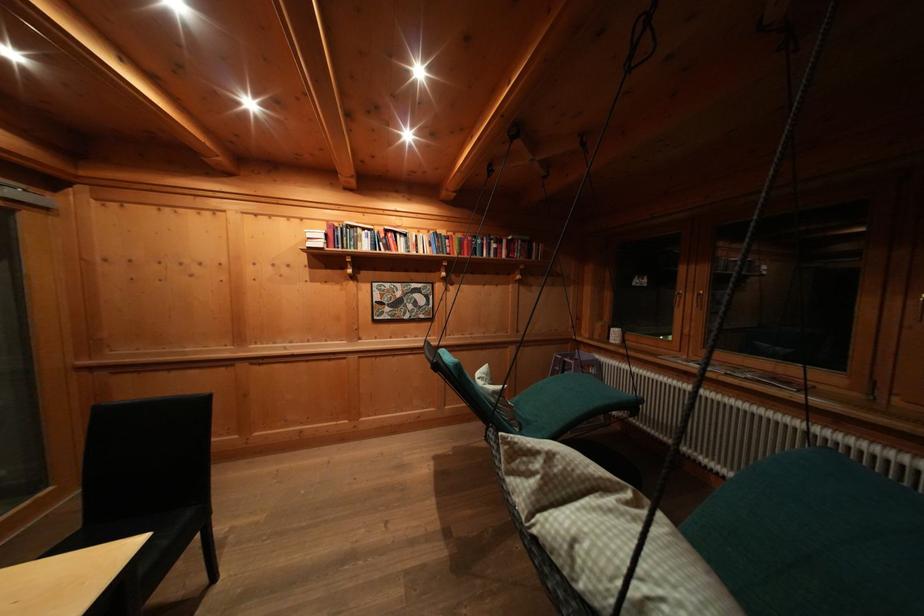
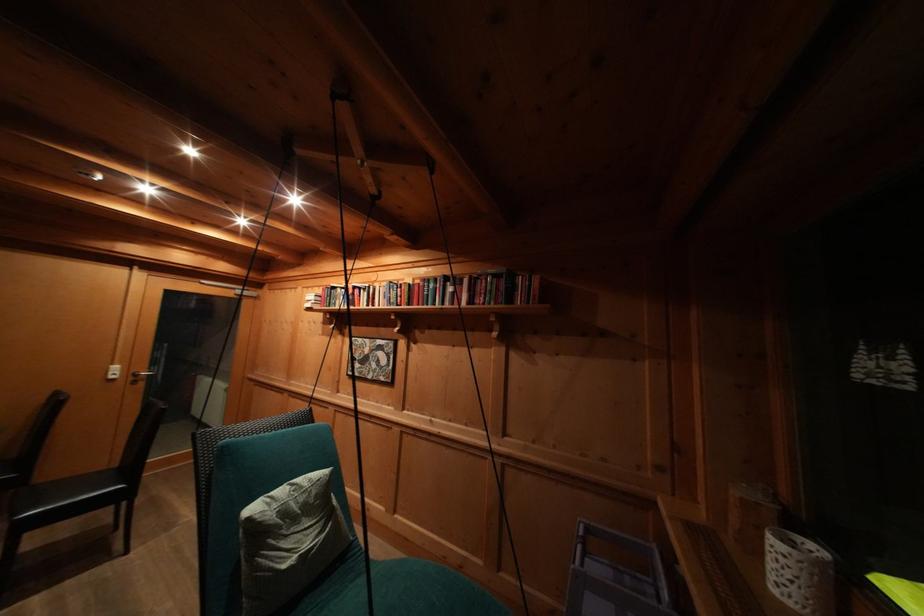
The point at (x=484, y=383) is marked in the first image. Where is the corresponding point in the second image?

(298, 490)